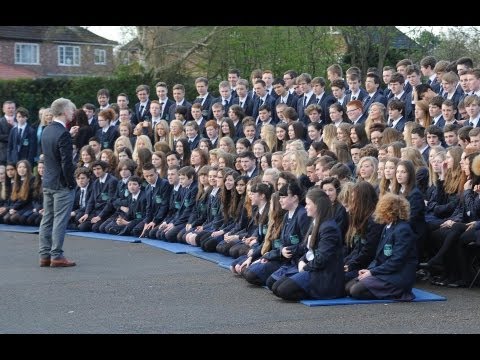
Find the location of a particular element. This screenshot has width=480, height=360. mats on ground is located at coordinates (114, 236), (167, 245), (202, 253), (226, 265), (315, 303), (10, 226).